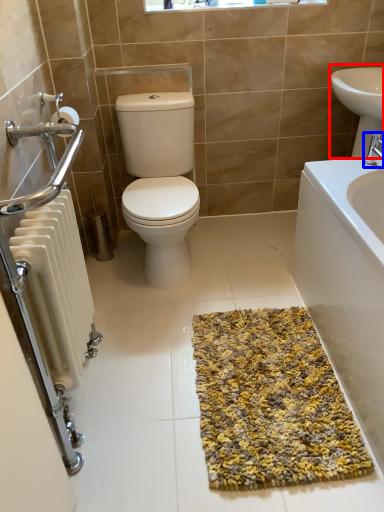
Question: Among these objects, which one is nearest to the camera, sink (highlighted by a red box) or tap (highlighted by a blue box)?

Choices:
 (A) sink
 (B) tap

Answer: (B)